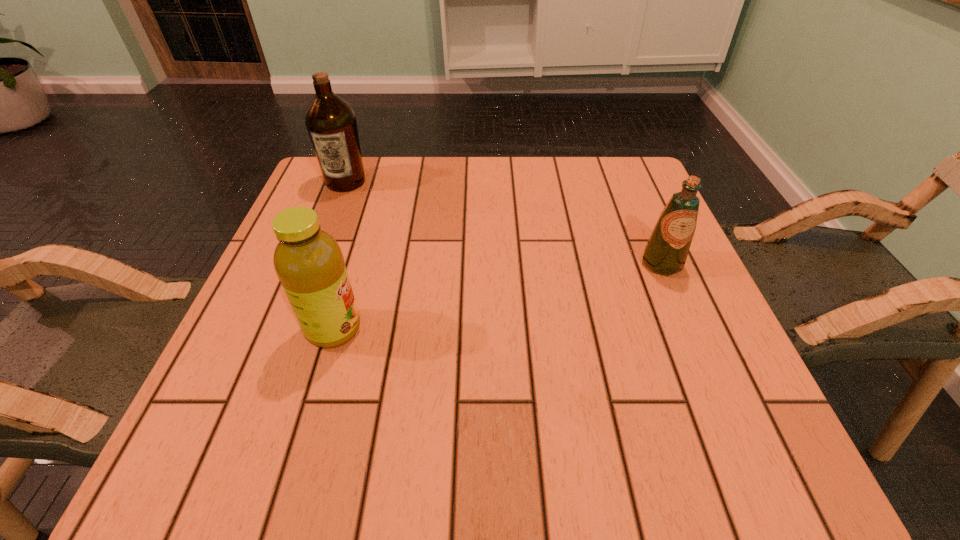
Locate an element on the screen. This screenshot has height=540, width=960. fruit juice located at the left edge is located at coordinates (309, 263).

The height and width of the screenshot is (540, 960). Find the location of `object present at the right edge`. object present at the right edge is located at coordinates (666, 251).

Find the location of a particular element. This screenshot has width=960, height=540. object located at the far left corner is located at coordinates (x=331, y=123).

Identify the location of vacant region at the far edge. Image resolution: width=960 pixels, height=540 pixels. (394, 200).

This screenshot has height=540, width=960. In order to click on free space at the near edge of the desktop in this screenshot , I will do `click(583, 446)`.

Find the location of `free location at the right edge`. free location at the right edge is located at coordinates (682, 366).

Identify the location of free space at the far left corner of the desktop. (370, 170).

In the image, there is a desktop. Find the location of `vacant space at the near left corner`. vacant space at the near left corner is located at coordinates (259, 442).

The height and width of the screenshot is (540, 960). Find the location of `vacant space at the far right corner of the desktop`. vacant space at the far right corner of the desktop is located at coordinates (621, 184).

In the image, there is a desktop. Identify the location of vacant space at the near right corner. This screenshot has height=540, width=960. (750, 438).